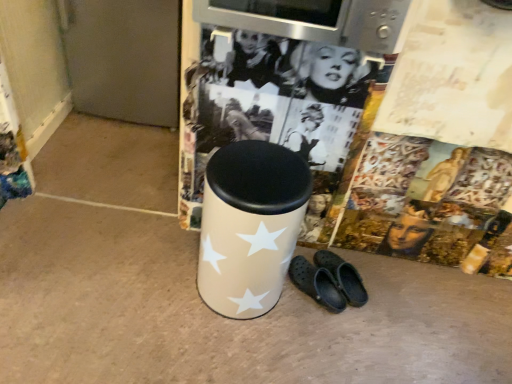
The image size is (512, 384). What do you see at coordinates (250, 226) in the screenshot?
I see `beige fabric waste bin at center` at bounding box center [250, 226].

I want to click on beige fabric waste bin at center, so click(250, 226).

This screenshot has width=512, height=384. What do you see at coordinates (328, 281) in the screenshot?
I see `black rubber crocs at lower center` at bounding box center [328, 281].

At what (x,y) coordinates should I click in order to perform the action: click on black rubber crocs at lower center. Please return your answer as a coordinate pair (x, y). The image size is (512, 384). Looking at the image, I should click on (328, 281).

Image resolution: width=512 pixels, height=384 pixels. I want to click on beige fabric waste bin at center, so [x=250, y=226].

In the scene shown: Visually, is beige fabric waste bin at center positioned to the left or to the right of black rubber crocs at lower center?

Clearly, beige fabric waste bin at center is on the left of black rubber crocs at lower center in the image.

Which object is further away from the camera taking this photo, beige fabric waste bin at center or black rubber crocs at lower center?

black rubber crocs at lower center is behind.

Is point (277, 242) closer or farther from the camera than point (360, 287)?

Point (277, 242) is closer to the camera than point (360, 287).

From the image's perspective, is beige fabric waste bin at center under black rubber crocs at lower center?

No.

From a real-world perspective, which object rests below the other?

From a 3D spatial view, black rubber crocs at lower center is below.

Which object is wider, beige fabric waste bin at center or black rubber crocs at lower center?

With larger width is beige fabric waste bin at center.

Can you confirm if beige fabric waste bin at center is taller than black rubber crocs at lower center?

Yes.

Which of these two, beige fabric waste bin at center or black rubber crocs at lower center, is bigger?

Bigger between the two is beige fabric waste bin at center.

Is beige fabric waste bin at center surrounding black rubber crocs at lower center?

No.

Are beige fabric waste bin at center and black rubber crocs at lower center located far from each other?

beige fabric waste bin at center is near black rubber crocs at lower center, not far away.

Is beige fabric waste bin at center oriented towards black rubber crocs at lower center?

No.

The width and height of the screenshot is (512, 384). What are the coordinates of `waste container that appears in front of the black rubber crocs at lower center` in the screenshot? It's located at (250, 226).

Does black rubber crocs at lower center appear on the right side of beige fabric waste bin at center?

Yes, black rubber crocs at lower center is to the right of beige fabric waste bin at center.

Which is in front, black rubber crocs at lower center or beige fabric waste bin at center?

beige fabric waste bin at center.

Which point is more forward, (351, 294) or (236, 204)?

The point (236, 204) is more forward.

From the image's perspective, does black rubber crocs at lower center appear lower than beige fabric waste bin at center?

Yes, from the image's perspective, black rubber crocs at lower center is below beige fabric waste bin at center.

From a real-world perspective, which is physically above, black rubber crocs at lower center or beige fabric waste bin at center?

beige fabric waste bin at center is physically above.

Can you confirm if black rubber crocs at lower center is wider than beige fabric waste bin at center?

No, black rubber crocs at lower center is not wider than beige fabric waste bin at center.

Considering the sizes of black rubber crocs at lower center and beige fabric waste bin at center in the image, is black rubber crocs at lower center taller or shorter than beige fabric waste bin at center?

black rubber crocs at lower center is shorter than beige fabric waste bin at center.

Considering the relative sizes of black rubber crocs at lower center and beige fabric waste bin at center in the image provided, is black rubber crocs at lower center smaller than beige fabric waste bin at center?

Indeed, black rubber crocs at lower center has a smaller size compared to beige fabric waste bin at center.

Can we say black rubber crocs at lower center lies outside beige fabric waste bin at center?

Yes, black rubber crocs at lower center is outside of beige fabric waste bin at center.

Is black rubber crocs at lower center not close to beige fabric waste bin at center?

black rubber crocs at lower center is near beige fabric waste bin at center, not far away.

Is black rubber crocs at lower center positioned with its back to beige fabric waste bin at center?

black rubber crocs at lower center does not have its back to beige fabric waste bin at center.

The image size is (512, 384). I want to click on footwear behind the beige fabric waste bin at center, so click(328, 281).

The image size is (512, 384). Find the location of `waste container on the left of black rubber crocs at lower center`. waste container on the left of black rubber crocs at lower center is located at coordinates (250, 226).

In the image, there is a beige fabric waste bin at center. At what (x,y) coordinates should I click in order to perform the action: click on footwear below it (from a real-world perspective). Please return your answer as a coordinate pair (x, y). Image resolution: width=512 pixels, height=384 pixels. Looking at the image, I should click on (328, 281).